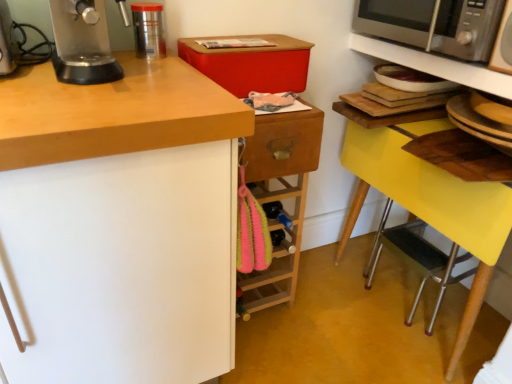
What are the coordinates of `free region under wooden drawer at center (from a real-world perspective)` in the screenshot? It's located at (270, 313).